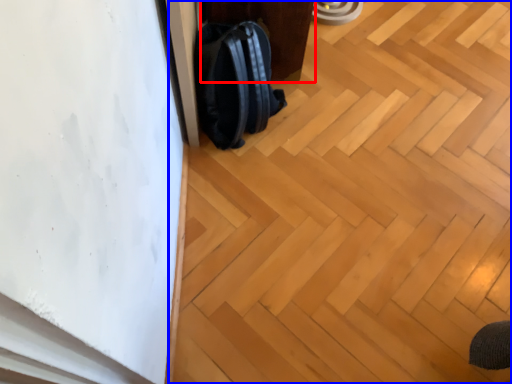
Question: Which object appears closest to the camera in this image, furniture (highlighted by a red box) or plywood (highlighted by a blue box)?

Choices:
 (A) furniture
 (B) plywood

Answer: (B)